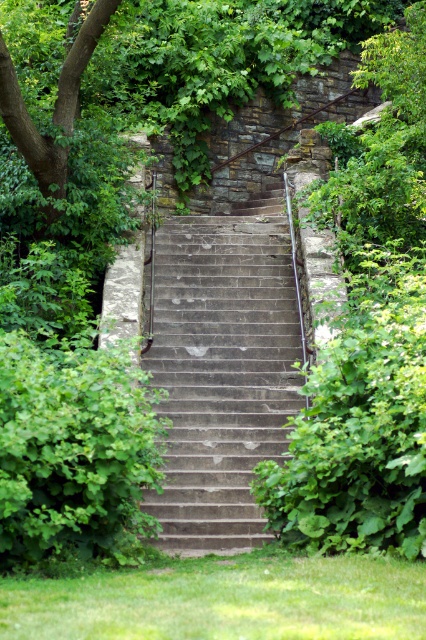
Who is lower down, gray concrete stairs at center or green leafy tree at upper left?

Positioned lower is gray concrete stairs at center.

This screenshot has width=426, height=640. Identify the location of gray concrete stairs at center. (222, 368).

You are a GUI agent. You are given a task and a screenshot of the screen. Output one action in this format:
    pyautogui.click(x=<x>, y=<y>)
    Task: Click on the gray concrete stairs at center
    
    Given the screenshot: What is the action you would take?
    pyautogui.click(x=222, y=368)